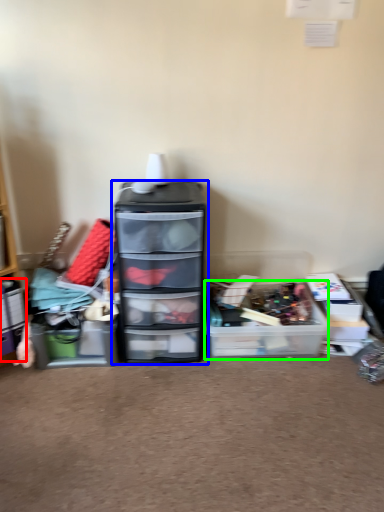
Question: Which object is the closest to the storage box (highlighted by a red box)? Choose among these: chest of drawers (highlighted by a blue box) or storage box (highlighted by a green box).

Choices:
 (A) chest of drawers
 (B) storage box

Answer: (A)